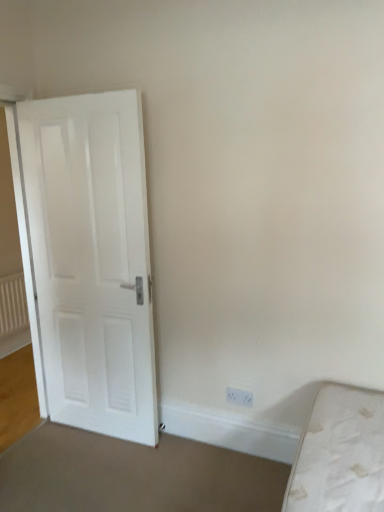
Find the location of a particular element. free spot to the right of white matte door at left is located at coordinates (173, 461).